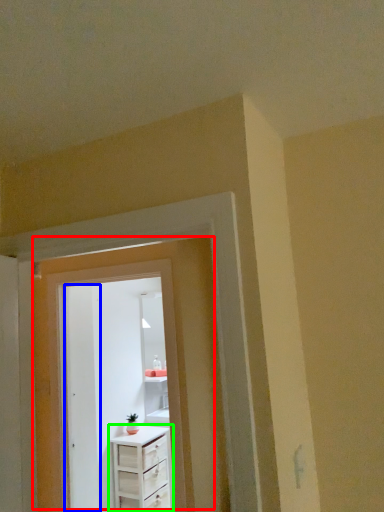
Question: Estimate the real-world distances between objects in this image. Which object is closer to door (highlighted by a red box), door (highlighted by a blue box) or chest of drawers (highlighted by a green box)?

Choices:
 (A) door
 (B) chest of drawers

Answer: (A)